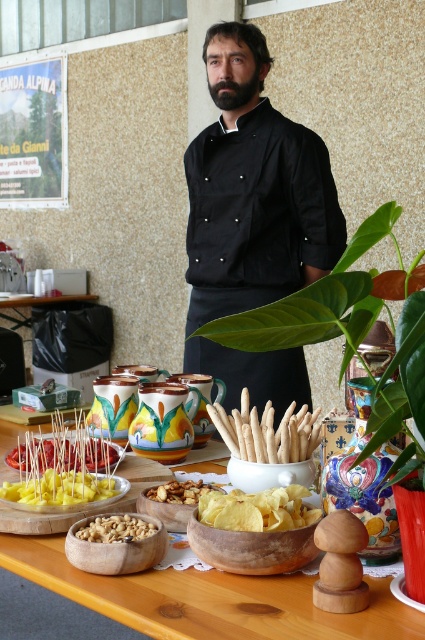
You are a guest at this event and want to grab both the yellow matte skewers at center and the yellow cheese sticks at center. How far apart are these two items from each other?

The yellow matte skewers at center and the yellow cheese sticks at center are 3.32 inches apart from each other.

You are a guest at this event and want to grab the yellow matte skewers at center. Since the black fabric chef at center is blocking your path, can you easily reach the skewers without moving the chef?

The black fabric chef at center has a larger size compared to yellow matte skewers at center, so the chef is likely blocking the path to the skewers. You would need to ask the chef to move or find another way around.